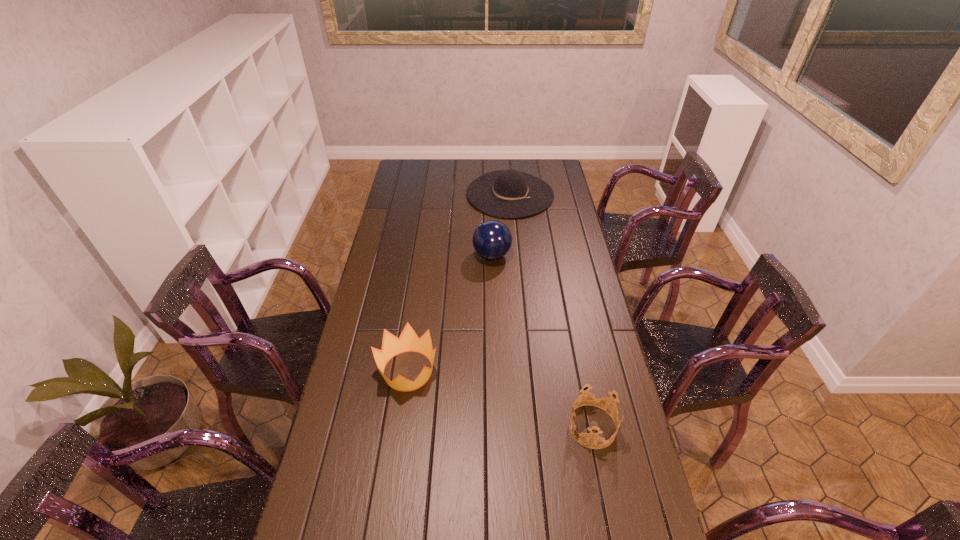
Where is `bowling ball`? The image size is (960, 540). bowling ball is located at coordinates (492, 240).

Where is `the tallest object`? The image size is (960, 540). the tallest object is located at coordinates (492, 240).

You are a GUI agent. You are given a task and a screenshot of the screen. Output one action in this format:
    pyautogui.click(x=<x>, y=<y>)
    Task: Click on the farthest object
    
    Given the screenshot: What is the action you would take?
    pyautogui.click(x=509, y=193)

Where is `the leftmost object`? the leftmost object is located at coordinates (408, 341).

This screenshot has width=960, height=540. Find the location of `the left crown`. the left crown is located at coordinates (408, 341).

Where is `the nearer crown`? the nearer crown is located at coordinates (602, 396).

The width and height of the screenshot is (960, 540). Find the location of `the right crown`. the right crown is located at coordinates click(x=602, y=396).

At what (x,y) coordinates should I click in order to perform the action: click on vacant space situated on the surface of the tallest object near the finger holes. Please return your answer as a coordinate pair (x, y). The height and width of the screenshot is (540, 960). Looking at the image, I should click on (422, 255).

Identify the location of vacant space situated 0.080m on the surface of the tallest object near the finger holes. This screenshot has height=540, width=960. (453, 255).

This screenshot has width=960, height=540. Find the location of `free region located on the surface of the tallest object near the finger holes`. free region located on the surface of the tallest object near the finger holes is located at coordinates (437, 255).